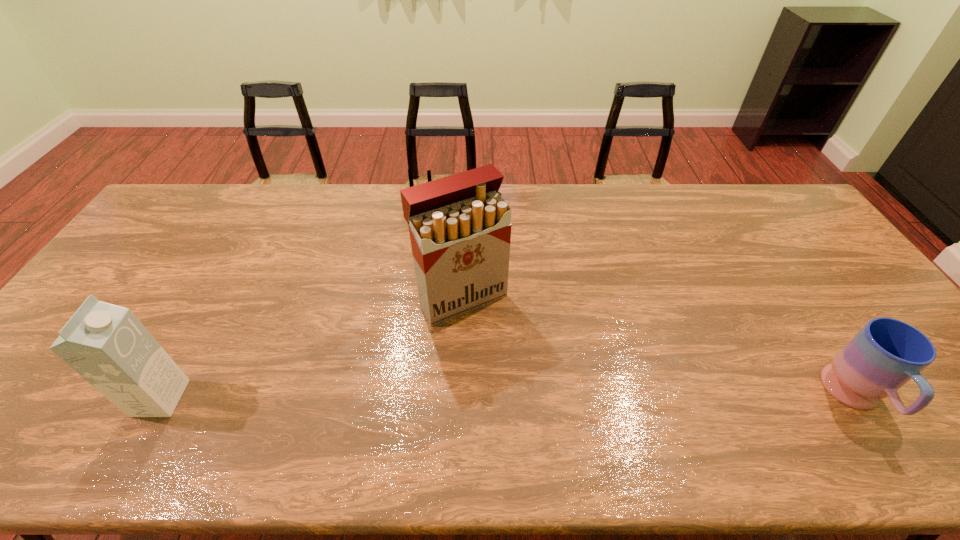
Where is `free space at the far right corner of the desktop`? The height and width of the screenshot is (540, 960). free space at the far right corner of the desktop is located at coordinates (757, 197).

Identify the location of free area in between the tallest object and the carton. point(311,348).

Locate an element on the screen. This screenshot has height=540, width=960. empty space that is in between the leftmost object and the rightmost object is located at coordinates (509, 398).

What are the coordinates of `free point between the second tallest object and the farthest object` in the screenshot? It's located at point(309,304).

You are a GUI agent. You are given a task and a screenshot of the screen. Output one action in this format:
    pyautogui.click(x=<x>, y=<y>)
    Task: Click on the empty space that is in between the leftmost object and the tallest object
    
    Given the screenshot: What is the action you would take?
    pyautogui.click(x=311, y=348)

The height and width of the screenshot is (540, 960). What are the coordinates of `vacant area that lies between the router and the third shortest object` in the screenshot? It's located at (309, 304).

Image resolution: width=960 pixels, height=540 pixels. Identify the location of vacant space that's between the third shortest object and the mug. (509, 398).

Identify the location of vacant region between the tallest object and the rightmost object. The image size is (960, 540). (660, 348).

Where is `free space that is in between the carton and the mug`? The image size is (960, 540). free space that is in between the carton and the mug is located at coordinates (509, 398).

This screenshot has width=960, height=540. I want to click on empty space between the carton and the rightmost object, so click(x=509, y=398).